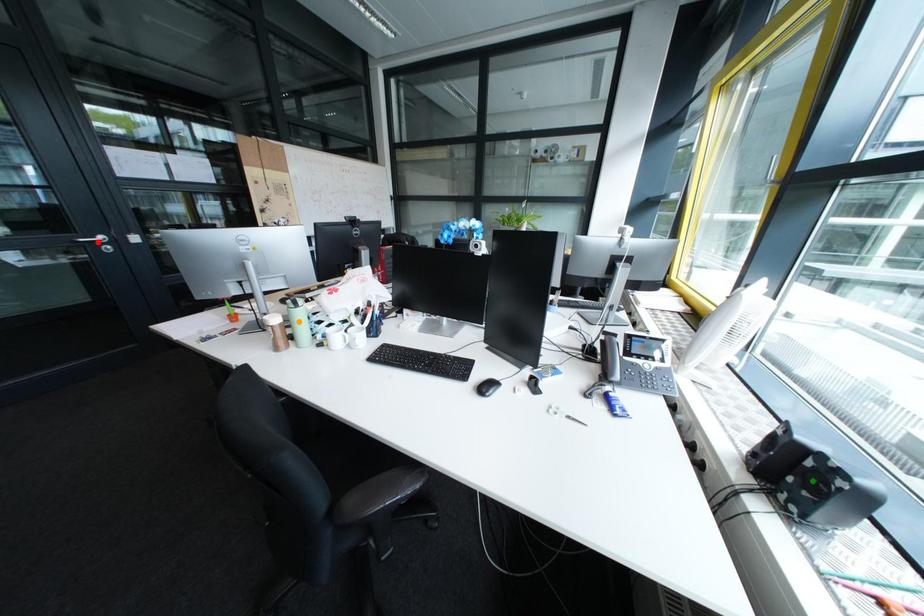
Order these from nearest to farthest:
- green point
- red point
- orange point

green point
orange point
red point